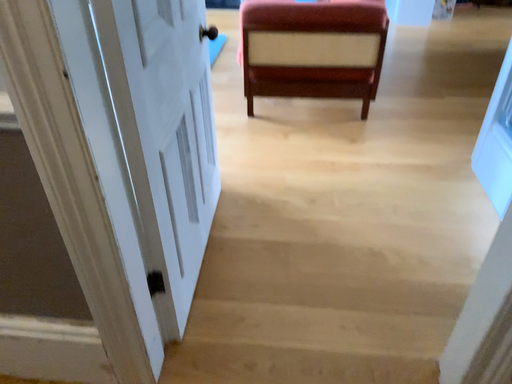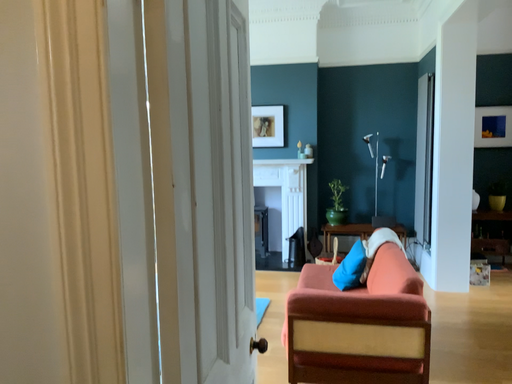
Question: How did the camera likely rotate when shooting the video?

Choices:
 (A) rotated downward
 (B) rotated upward

Answer: (B)